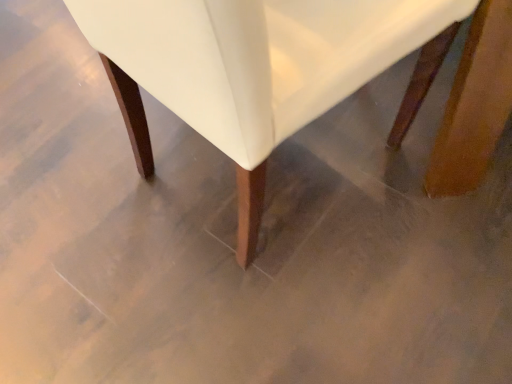
Find the location of a particular element. The width and height of the screenshot is (512, 384). vacant space in front of matte white chair at center is located at coordinates (274, 322).